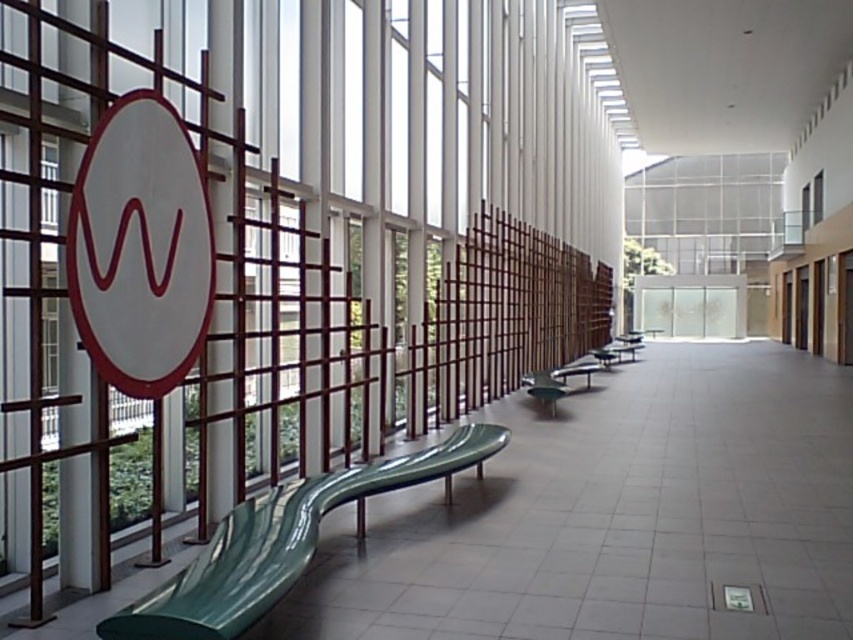
Does white matte sign at upper left come in front of green glossy bench at lower left?

No, it is not.

Which is in front, point (149, 321) or point (239, 614)?

Positioned in front is point (239, 614).

Locate an element on the screen. The image size is (853, 640). white matte sign at upper left is located at coordinates (140, 248).

Who is positioned more to the right, white matte sign at upper left or clear glass window at upper left?

Positioned to the right is white matte sign at upper left.

Is white matte sign at upper left smaller than clear glass window at upper left?

No, white matte sign at upper left is not smaller than clear glass window at upper left.

Locate an element on the screen. white matte sign at upper left is located at coordinates (140, 248).

Does green glossy bench at lower left have a greater width compared to green glossy bench at center?

Yes, green glossy bench at lower left is wider than green glossy bench at center.

Measure the distance between point (218, 632) and camera.

Point (218, 632) and camera are 3.02 meters apart.

Which is behind, point (312, 547) or point (572, 369)?

Positioned behind is point (572, 369).

You are a GUI agent. You are given a task and a screenshot of the screen. Output one action in this format:
    pyautogui.click(x=<x>, y=<y>)
    Task: Click on the green glossy bench at lower left
    
    Given the screenshot: What is the action you would take?
    pyautogui.click(x=283, y=541)